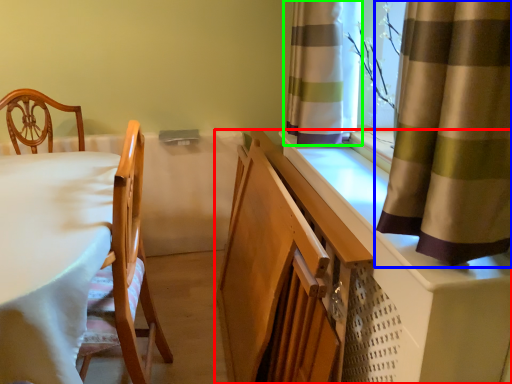
Question: Which is farther away from cabinetry (highlighted by a red box)? curtain (highlighted by a blue box) or curtain (highlighted by a green box)?

Choices:
 (A) curtain
 (B) curtain

Answer: (B)